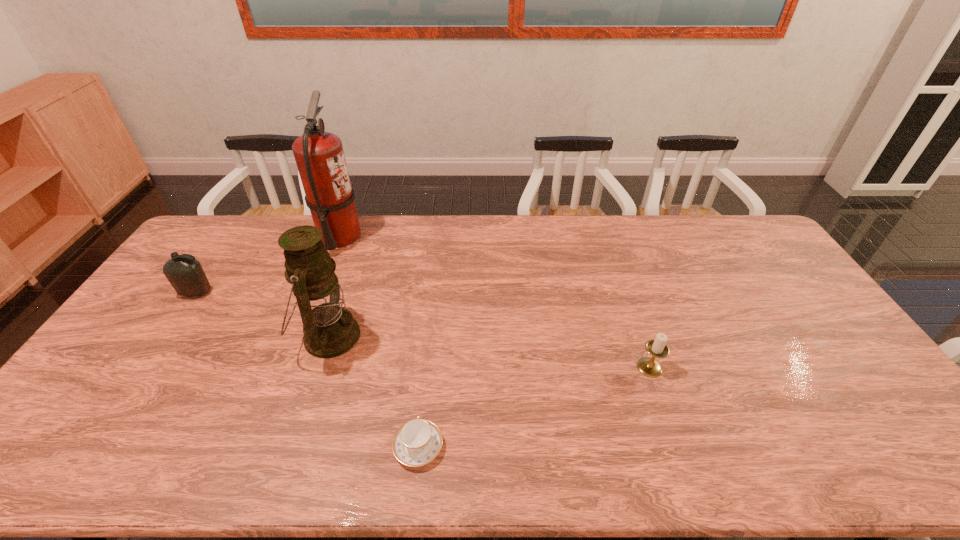
You are a GUI agent. You are given a task and a screenshot of the screen. Output one action in this format:
    pyautogui.click(x=<x>, y=<y>)
    Task: Click on the vacant space at the near edge of the desktop
    
    Given the screenshot: What is the action you would take?
    pyautogui.click(x=660, y=452)

In the image, there is a desktop. What are the coordinates of `vacant area at the left edge` in the screenshot? It's located at (175, 316).

This screenshot has height=540, width=960. In order to click on vacant area at the right edge of the desktop in this screenshot , I will do `click(839, 362)`.

I want to click on free region at the far right corner, so click(x=747, y=241).

Where is `free space between the second shortest object and the nearest object`? This screenshot has height=540, width=960. free space between the second shortest object and the nearest object is located at coordinates (534, 407).

Image resolution: width=960 pixels, height=540 pixels. Find the location of `unoccupied area between the farthest object and the nearest object`. unoccupied area between the farthest object and the nearest object is located at coordinates (379, 341).

Locate an element on the screen. vacant space that is in between the rightmost object and the teacup is located at coordinates (534, 407).

Identify the location of free space between the tallest object and the second shortest object. (494, 302).

You are a GUI agent. You are given a task and a screenshot of the screen. Output one action in this format:
    pyautogui.click(x=<x>, y=<y>)
    Task: Click on the free spot between the fourth tallest object and the nearest object
    
    Given the screenshot: What is the action you would take?
    pyautogui.click(x=534, y=407)

At what (x,y) coordinates should I click in order to perform the action: click on empty space between the fire extinguisher and the third shortest object. Please return your answer as a coordinate pair (x, y). This screenshot has width=960, height=540. Looking at the image, I should click on (268, 265).